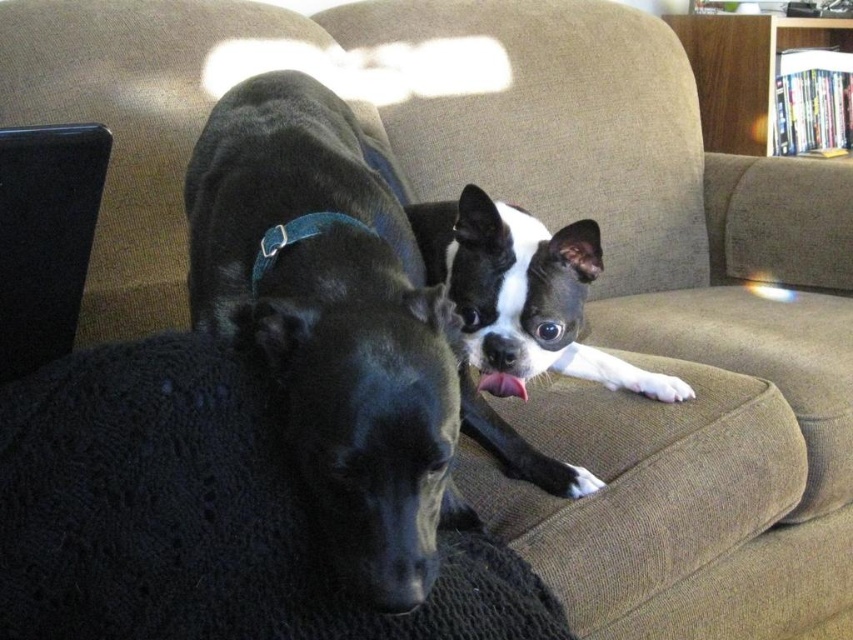
Question: Does black matte dog at center appear under wooden bookshelf at upper right?

Choices:
 (A) yes
 (B) no

Answer: (A)

Question: Estimate the real-world distances between objects in this image. Which object is farther from the wooden bookshelf at upper right?

Choices:
 (A) black matte dog at center
 (B) blue fabric neckband at center

Answer: (B)

Question: Which of these objects is positioned closest to the black matte dog at center?

Choices:
 (A) wooden bookshelf at upper right
 (B) blue fabric neckband at center

Answer: (B)

Question: Which point appears closest to the camera in this image?

Choices:
 (A) (405, 324)
 (B) (346, 221)

Answer: (A)

Question: Is black matte dog at center positioned before wooden bookshelf at upper right?

Choices:
 (A) yes
 (B) no

Answer: (A)

Question: Does wooden bookshelf at upper right come in front of blue fabric neckband at center?

Choices:
 (A) yes
 (B) no

Answer: (B)